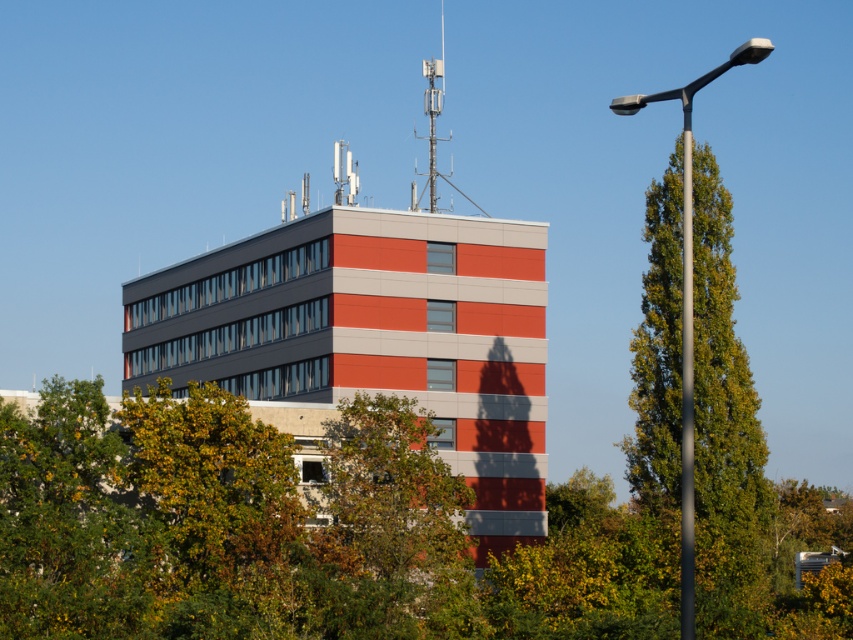
Question: Which point is farther to the camera?

Choices:
 (A) (685, 429)
 (B) (746, 554)
 (C) (160, 364)

Answer: (C)

Question: Is sleek metallic pole at right above metallic gray pole at right?

Choices:
 (A) yes
 (B) no

Answer: (A)

Question: Can you confirm if green leafy tree at center is positioned above red brick building at center?

Choices:
 (A) no
 (B) yes

Answer: (A)

Question: Based on their relative distances, which object is nearer to the sleek metallic pole at right?

Choices:
 (A) metallic gray pole at right
 (B) red brick building at center

Answer: (A)

Question: Which is nearer to the red brick building at center?

Choices:
 (A) green leafy tree at center
 (B) sleek metallic pole at right
 (C) metallic gray pole at right

Answer: (A)

Question: Does red brick building at center have a smaller size compared to sleek metallic pole at right?

Choices:
 (A) yes
 (B) no

Answer: (A)